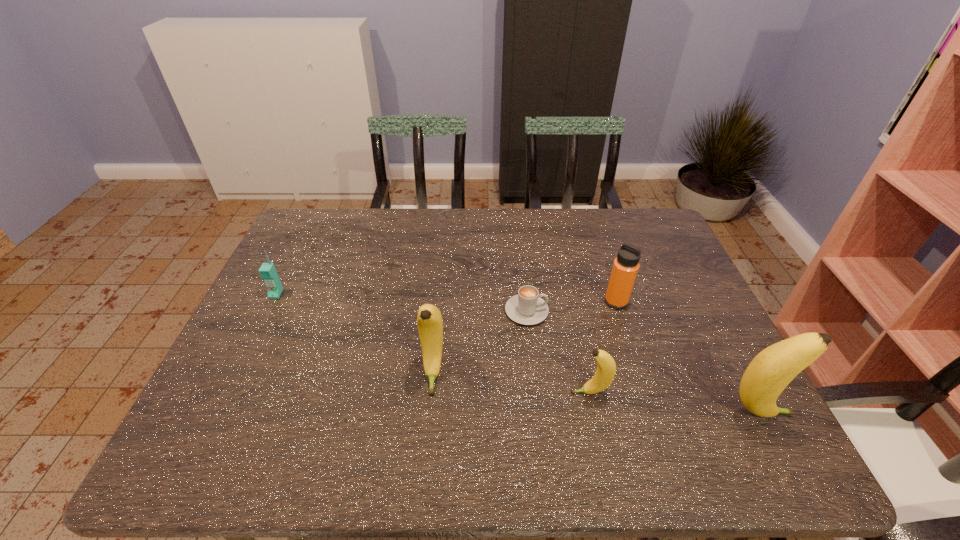
Find the location of a particular element. The height and width of the screenshot is (540, 960). free area in between the leftmost banana and the fifth object from left to right is located at coordinates (524, 338).

The width and height of the screenshot is (960, 540). Find the location of `free space between the cellular telephone and the cappuccino`. free space between the cellular telephone and the cappuccino is located at coordinates (401, 302).

Locate an element on the screen. free spot between the thermos bottle and the cellular telephone is located at coordinates (446, 298).

Where is `free space between the nearest banana and the thermos bottle`? The image size is (960, 540). free space between the nearest banana and the thermos bottle is located at coordinates (687, 357).

Locate an element on the screen. Image resolution: width=960 pixels, height=540 pixels. free space between the second object from right to left and the shortest object is located at coordinates (571, 306).

Image resolution: width=960 pixels, height=540 pixels. I want to click on free spot between the thermos bottle and the leftmost banana, so click(x=524, y=338).

Choose which object is the fourth nearest neighbor to the shortest object. Please provide its 2D coordinates. Your answer should be formatted as a tuple, i.e. [(x, y)], where the tuple contains the x and y coordinates of a point satisfying the conditions above.

[(769, 373)]

Where is `object that ranks as the fifth closest to the nearest banana`? The width and height of the screenshot is (960, 540). object that ranks as the fifth closest to the nearest banana is located at coordinates (268, 273).

Point out which banana is positioned as the nearest to the second object from left to right. Please provide its 2D coordinates. Your answer should be formatted as a tuple, i.e. [(x, y)], where the tuple contains the x and y coordinates of a point satisfying the conditions above.

[(606, 367)]

Locate an element on the screen. banana that is the closest to the leftmost object is located at coordinates (429, 320).